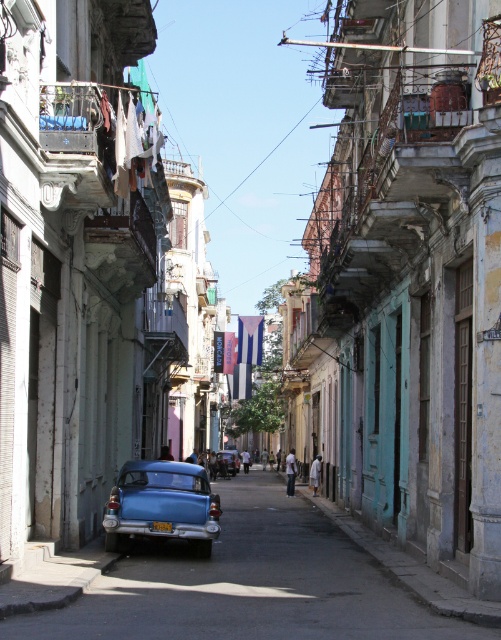
Question: Which of these objects is positioned farthest from the yellow plastic license plate at center?

Choices:
 (A) metallic blue car at center
 (B) matte blue car at center

Answer: (A)

Question: Is metallic blue car at center to the left of matte blue car at center from the viewer's perspective?

Choices:
 (A) no
 (B) yes

Answer: (A)

Question: Which of the following is the farthest from the observer?

Choices:
 (A) metallic blue car at center
 (B) yellow plastic license plate at center

Answer: (B)

Question: Does metallic blue car at center have a lesser width compared to matte blue car at center?

Choices:
 (A) yes
 (B) no

Answer: (B)

Question: Can you confirm if metallic blue car at center is thinner than yellow plastic license plate at center?

Choices:
 (A) no
 (B) yes

Answer: (A)

Question: Which is nearer to the yellow plastic license plate at center?

Choices:
 (A) metallic blue car at center
 (B) matte blue car at center

Answer: (B)